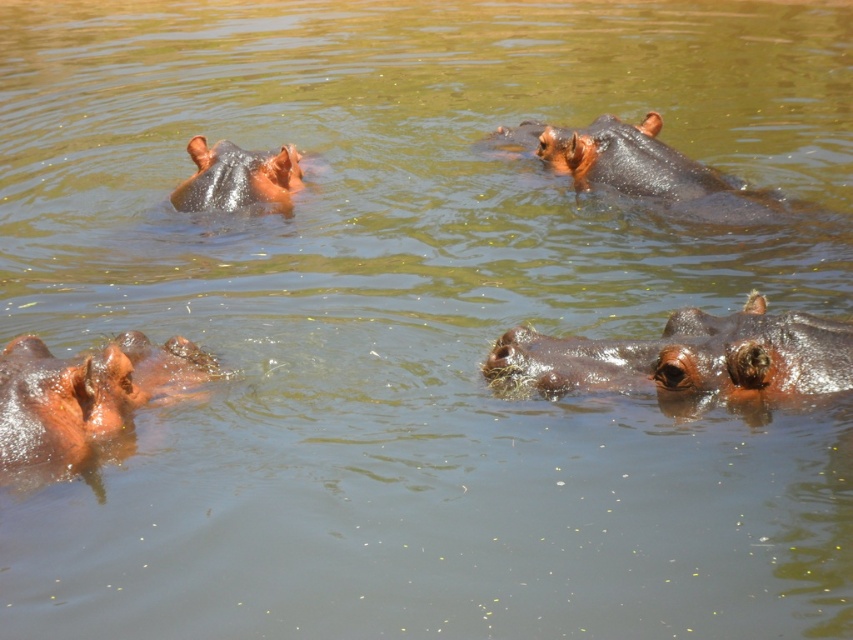
You are a wildlife photographer aiming to capture a closeup shot of the brown matte hippo at lower right and the brown matte hippo at upper left. Based on their sizes, which hippo would require you to use a wider lens to ensure it fits entirely in the frame?

The brown matte hippo at lower right might be wider than the brown matte hippo at upper left, so you would need a wider lens to capture the brown matte hippo at lower right in full.

You are observing hippos in their natural habitat. You notice two points in the scene labeled as point 1 at coordinates (x=543, y=362) and point 2 at coordinates (x=277, y=184). Which point is closer to your viewpoint?

Point 1 at coordinates (x=543, y=362) is closer to the camera than point 2 at coordinates (x=277, y=184).